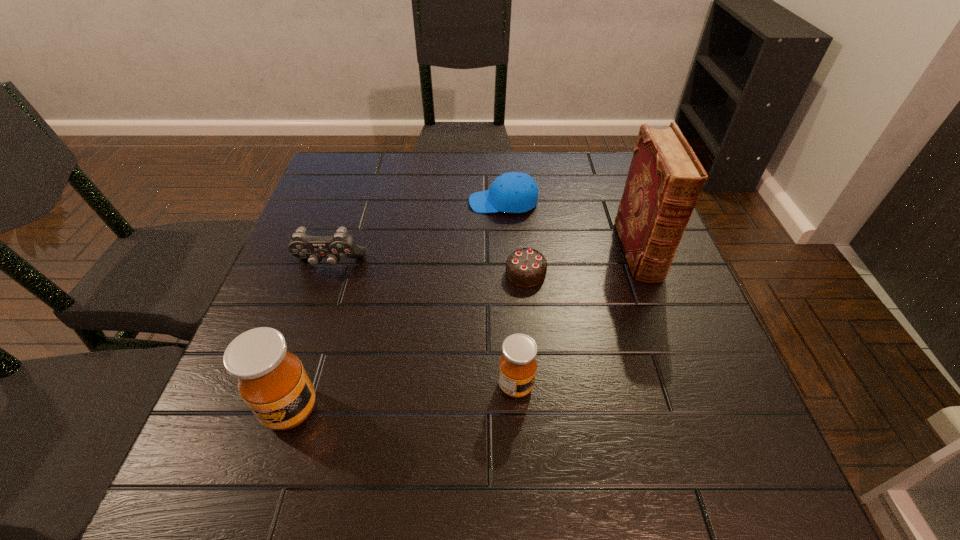
Where is `free spot between the control and the shortest object`? The height and width of the screenshot is (540, 960). free spot between the control and the shortest object is located at coordinates click(428, 269).

At what (x,y) coordinates should I click in order to perform the action: click on vacant area between the right honey and the cap. Please return your answer as a coordinate pair (x, y). Image resolution: width=960 pixels, height=540 pixels. Looking at the image, I should click on (510, 294).

Where is `vacant region between the shortest object and the taller honey`? vacant region between the shortest object and the taller honey is located at coordinates (408, 341).

Identify the location of vacant area between the second tallest object and the second shortest object. (397, 306).

Locate an element on the screen. Image resolution: width=960 pixels, height=540 pixels. vacant region between the hardback book and the shortest object is located at coordinates (582, 262).

In order to click on unoccupied position between the chocolate cake and the hardback book in this screenshot , I will do `click(582, 262)`.

Locate an element on the screen. vacant space in between the fifth shortest object and the control is located at coordinates (310, 337).

This screenshot has height=540, width=960. What are the coordinates of `object that is the fifth closest one to the shortest object` in the screenshot? It's located at (272, 381).

You are a GUI agent. You are given a task and a screenshot of the screen. Output one action in this format:
    pyautogui.click(x=<x>, y=<y>)
    Task: Click on the second closest object relative to the hardback book
    The height and width of the screenshot is (540, 960).
    Given the screenshot: What is the action you would take?
    pyautogui.click(x=525, y=267)

Where is `vacant area that satisfies the following two spatial constraints: 1. on the front-facing side of the shortest object; 2. on the left side of the second shortest object`? The height and width of the screenshot is (540, 960). vacant area that satisfies the following two spatial constraints: 1. on the front-facing side of the shortest object; 2. on the left side of the second shortest object is located at coordinates (508, 273).